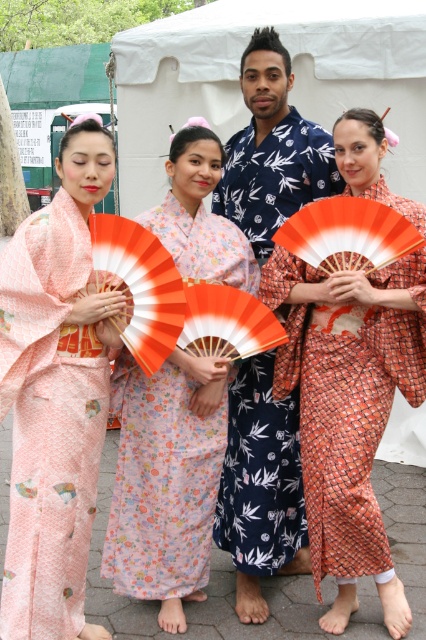
You are organizing a traditional Japanese tea ceremony and need to arrange seating for two guests wearing the matte peach kimono at left and the floral silk kimono at center. Given their kimono sizes, which guest should be seated closer to the tea ceremony host to ensure comfort?

The matte peach kimono at left is larger than the floral silk kimono at center, so the guest wearing the matte peach kimono at left should be seated closer to the host to accommodate their larger garment comfortably.

You are taking a photo of the group under the white canopy tent. You want to focus on the person at point (419, 248) and the person at point (138, 468). Which of these two people will be in sharper focus if you focus on the closer one?

Point (419, 248) is closer to the camera than point (138, 468). If you focus on the closer one, the person at point (419, 248) will be in sharper focus.